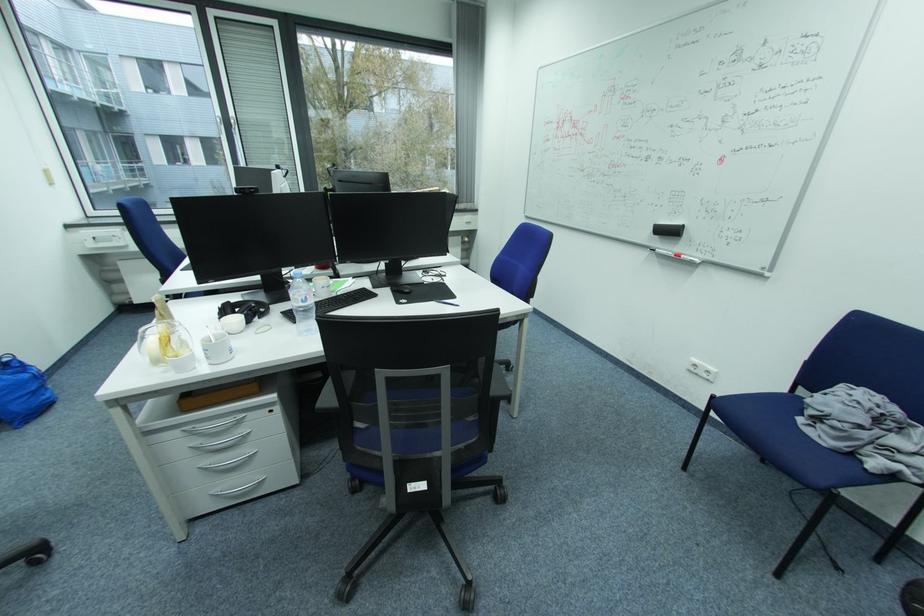
Image resolution: width=924 pixels, height=616 pixels. Describe the element at coordinates (165, 338) in the screenshot. I see `the yellow jar stopper` at that location.